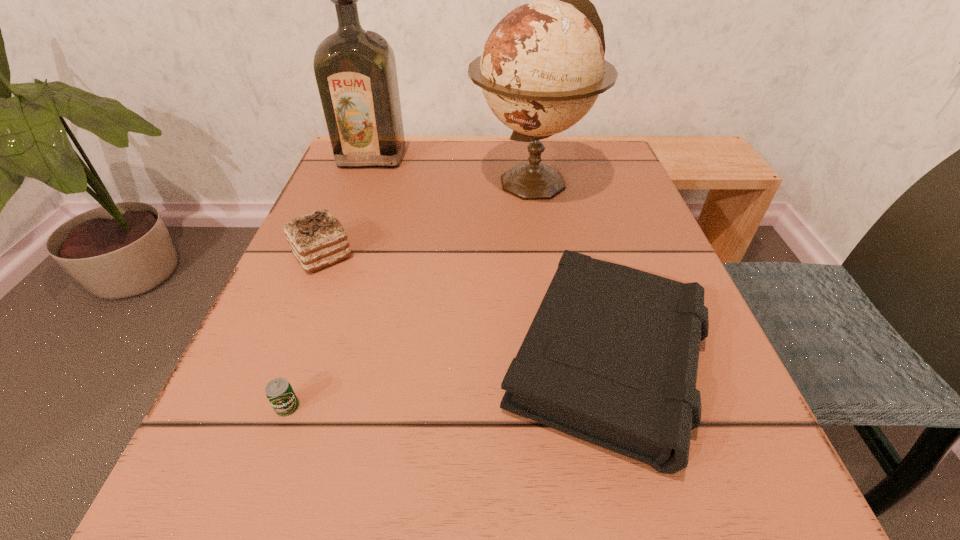
You are a GUI agent. You are given a task and a screenshot of the screen. Output one action in this format:
    pyautogui.click(x=<x>, y=<y>)
    Task: Click on the free space that satisfies the following two spatial constraints: 1. on the front of the globe showing Asia; 2. on the back side of the Bible
    
    Given the screenshot: What is the action you would take?
    pyautogui.click(x=561, y=361)

Locate an element on the screen. blank space that satisfies the following two spatial constraints: 1. on the front of the globe showing Asia; 2. on the front side of the chocolate cake is located at coordinates (543, 255).

This screenshot has height=540, width=960. I want to click on blank area in the image that satisfies the following two spatial constraints: 1. on the front of the Bible showing Asia; 2. on the left side of the globe, so click(x=561, y=361).